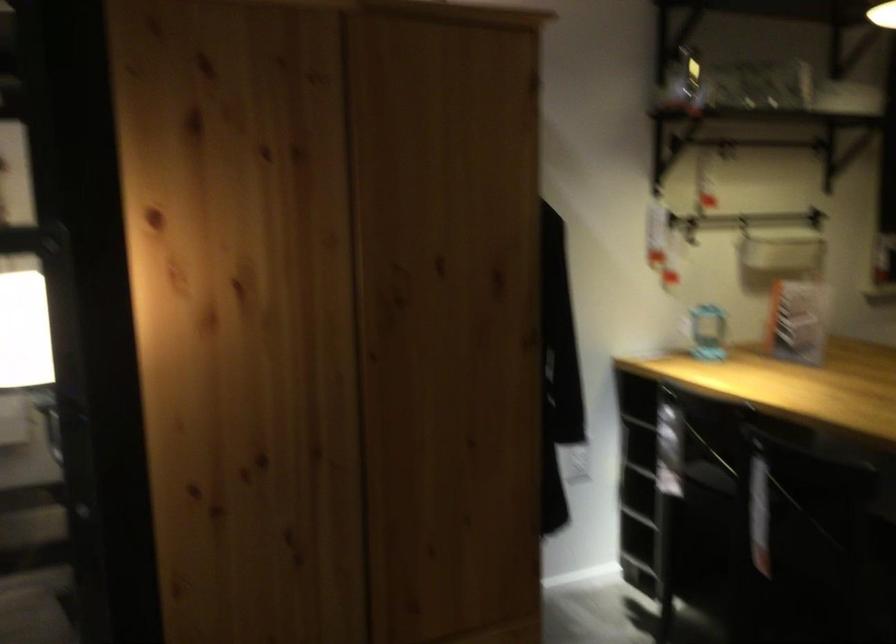
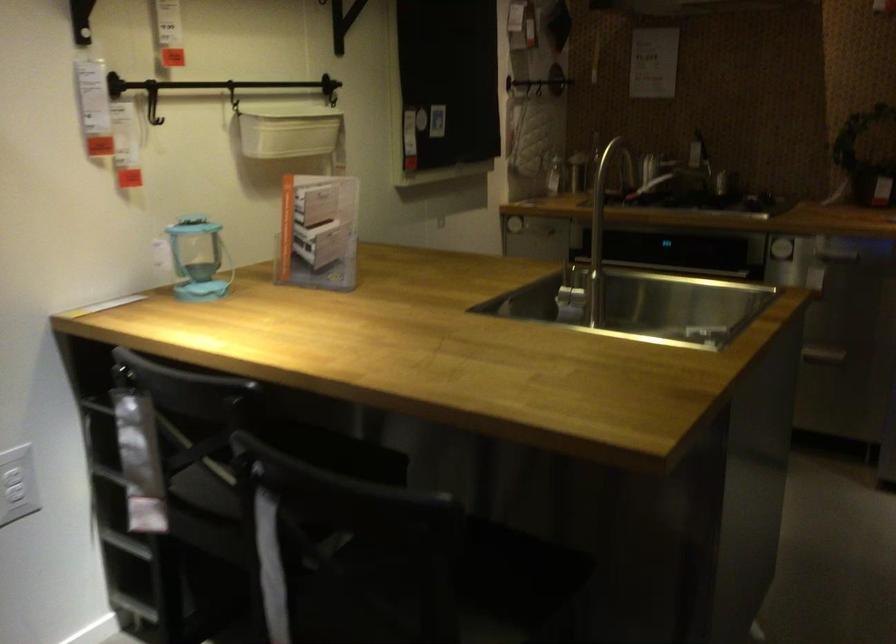
Find the pixel in the second image that matches point 807,234 in the first image.

(287, 129)